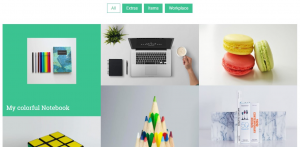
At what (x,y) coordinates should I click in order to perform the action: click on plant. Please return your answer as a coordinate pair (x, y). The width and height of the screenshot is (300, 147). Looking at the image, I should click on (113, 35).